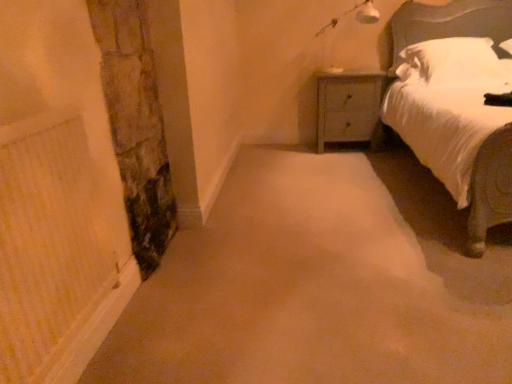
Question: Is stone textured pillar at left oriented away from white soft pillow at upper right?

Choices:
 (A) no
 (B) yes

Answer: (A)

Question: From a real-world perspective, does stone textured pillar at left stand above white soft pillow at upper right?

Choices:
 (A) no
 (B) yes

Answer: (A)

Question: Is stone textured pillar at left aimed at white soft pillow at upper right?

Choices:
 (A) yes
 (B) no

Answer: (B)

Question: Is stone textured pillar at left further to the viewer compared to white soft pillow at upper right?

Choices:
 (A) yes
 (B) no

Answer: (B)

Question: From a real-world perspective, is stone textured pillar at left physically below white soft pillow at upper right?

Choices:
 (A) yes
 (B) no

Answer: (A)

Question: Is stone textured pillar at left to the right of white soft pillow at upper right from the viewer's perspective?

Choices:
 (A) no
 (B) yes

Answer: (A)

Question: Can you confirm if white plastic lamp at upper right is bigger than white soft pillow at upper right?

Choices:
 (A) no
 (B) yes

Answer: (A)

Question: From a real-world perspective, is white plastic lamp at upper right located higher than white soft pillow at upper right?

Choices:
 (A) yes
 (B) no

Answer: (A)

Question: Considering the relative sizes of white plastic lamp at upper right and white soft pillow at upper right in the image provided, is white plastic lamp at upper right wider than white soft pillow at upper right?

Choices:
 (A) no
 (B) yes

Answer: (A)

Question: Is white plastic lamp at upper right smaller than white soft pillow at upper right?

Choices:
 (A) no
 (B) yes

Answer: (B)

Question: From the image's perspective, would you say white plastic lamp at upper right is shown under white soft pillow at upper right?

Choices:
 (A) no
 (B) yes

Answer: (A)

Question: Would you consider white plastic lamp at upper right to be distant from white soft pillow at upper right?

Choices:
 (A) no
 (B) yes

Answer: (A)

Question: Could you tell me if wooden nightstand at upper right is turned towards white plastic lamp at upper right?

Choices:
 (A) no
 (B) yes

Answer: (A)